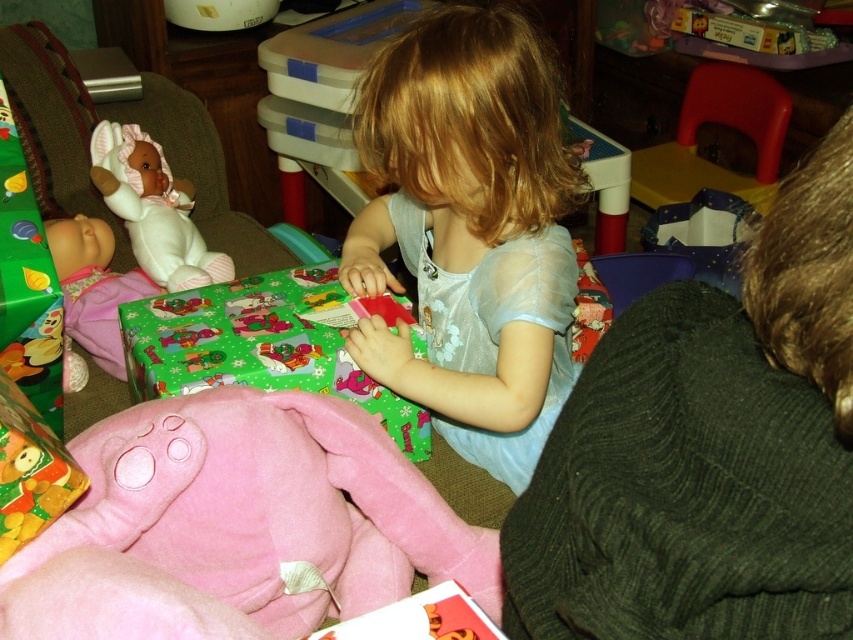
Question: Can you confirm if pink plush pig at lower left is bigger than light blue sheer dress at center?

Choices:
 (A) no
 (B) yes

Answer: (A)

Question: Which is farther from the light blue sheer dress at center?

Choices:
 (A) pink plush pig at lower left
 (B) white plush baby doll at left
 (C) white plush doll at left

Answer: (B)

Question: Is light blue sheer dress at center further to camera compared to white plush doll at left?

Choices:
 (A) no
 (B) yes

Answer: (A)

Question: Which object is the closest to the white plush baby doll at left?

Choices:
 (A) white plush doll at left
 (B) light blue sheer dress at center

Answer: (A)

Question: Estimate the real-world distances between objects in this image. Which object is closer to the white plush doll at left?

Choices:
 (A) light blue sheer dress at center
 (B) white plush baby doll at left
 (C) green glossy wrapping paper at center
 (D) pink plush pig at lower left

Answer: (B)

Question: Does green glossy wrapping paper at center appear on the right side of white plush baby doll at left?

Choices:
 (A) no
 (B) yes

Answer: (B)